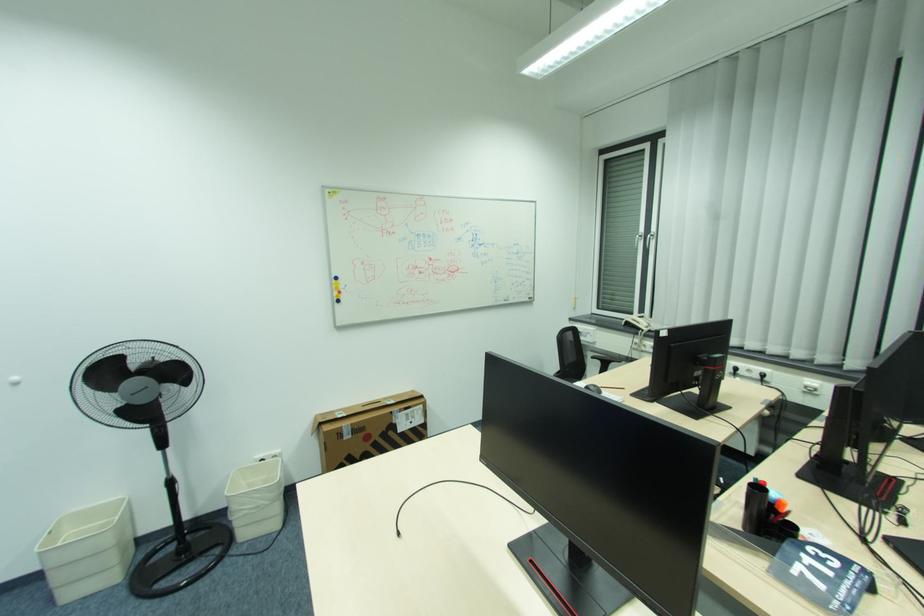
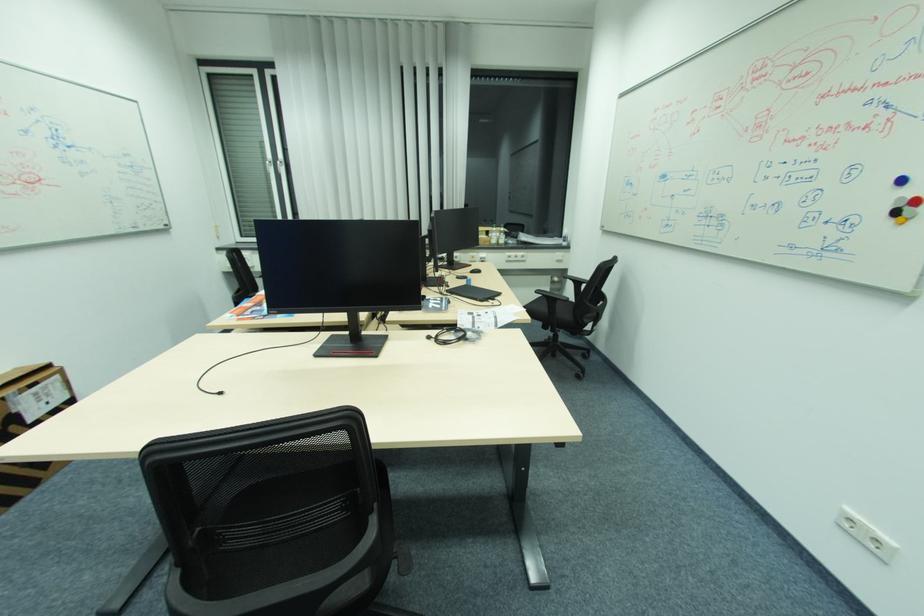
The point at (492, 463) is marked in the first image. Where is the corresponding point in the second image?

(282, 312)